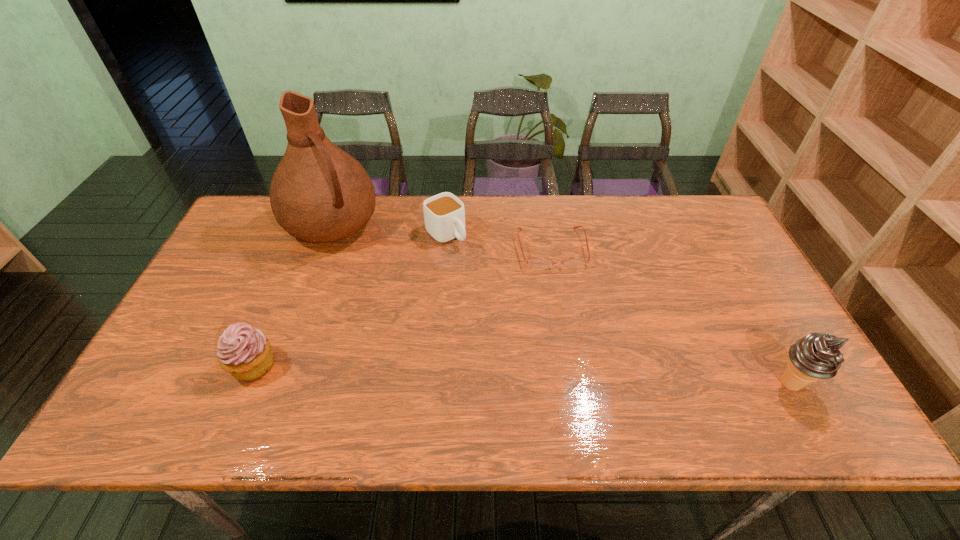
Where is `cup that is positioned at the far edge`? Image resolution: width=960 pixels, height=540 pixels. cup that is positioned at the far edge is located at coordinates (444, 214).

The height and width of the screenshot is (540, 960). Find the location of `pitcher that is at the far edge`. pitcher that is at the far edge is located at coordinates (319, 193).

The height and width of the screenshot is (540, 960). Find the location of `cupcake positioned at the near edge`. cupcake positioned at the near edge is located at coordinates (245, 352).

Locate an element on the screen. This screenshot has width=960, height=540. icecream located at the near edge is located at coordinates (816, 356).

You are a GUI agent. You are given a task and a screenshot of the screen. Output one action in this format:
    pyautogui.click(x=<x>, y=<y>)
    Task: Click on the object present at the left edge
    The image size is (960, 540).
    Given the screenshot: What is the action you would take?
    pyautogui.click(x=319, y=193)

The width and height of the screenshot is (960, 540). I want to click on object located in the right edge section of the desktop, so click(x=816, y=356).

The width and height of the screenshot is (960, 540). Identify the location of object at the far left corner. (319, 193).

This screenshot has width=960, height=540. In order to click on object present at the near right corner in this screenshot , I will do `click(816, 356)`.

This screenshot has height=540, width=960. Identify the location of vacant space at the far edge of the desktop. (648, 221).

Locate an element on the screen. Image resolution: width=960 pixels, height=540 pixels. vacant space at the near edge of the desktop is located at coordinates (276, 362).